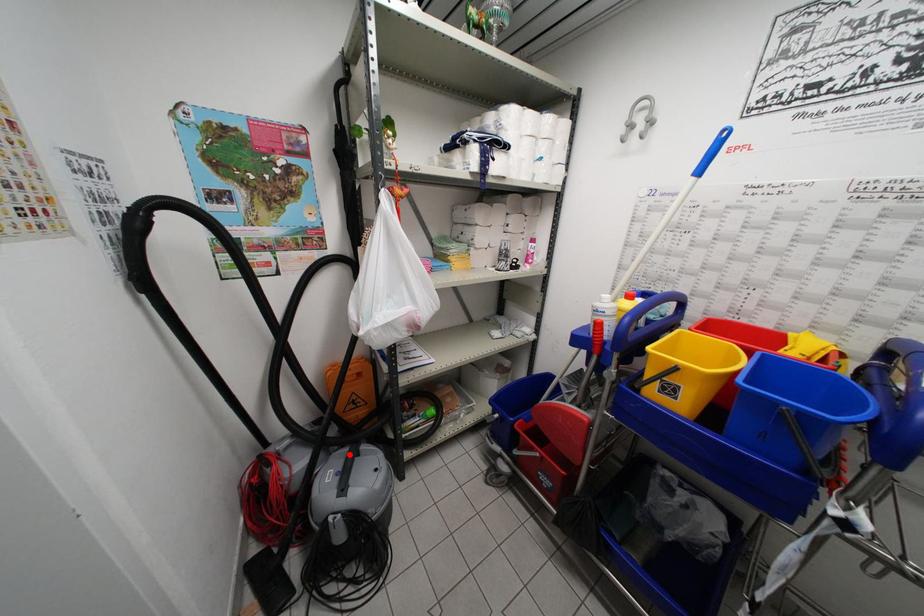
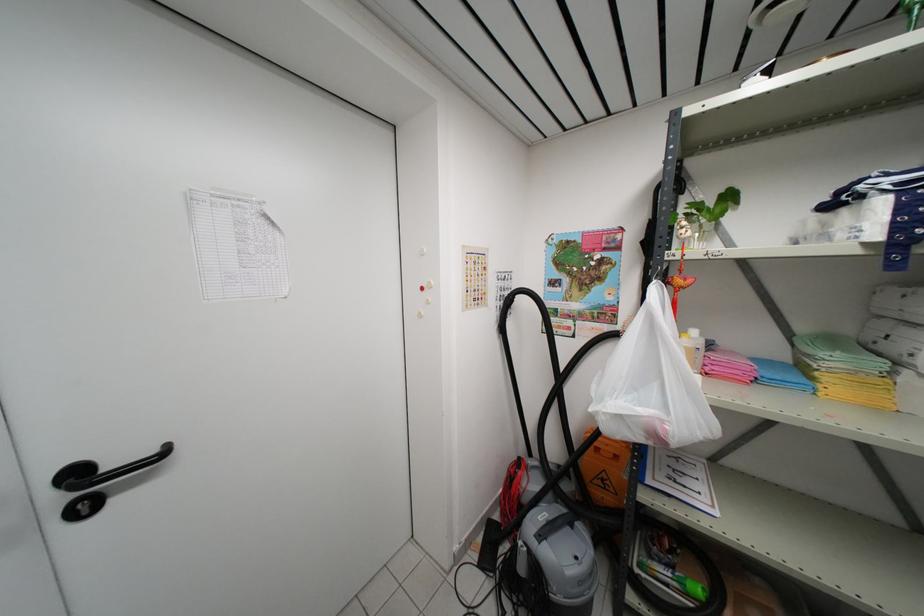
Where in the second image is the point corresponding to the highlighted location from the first image?

(566, 515)